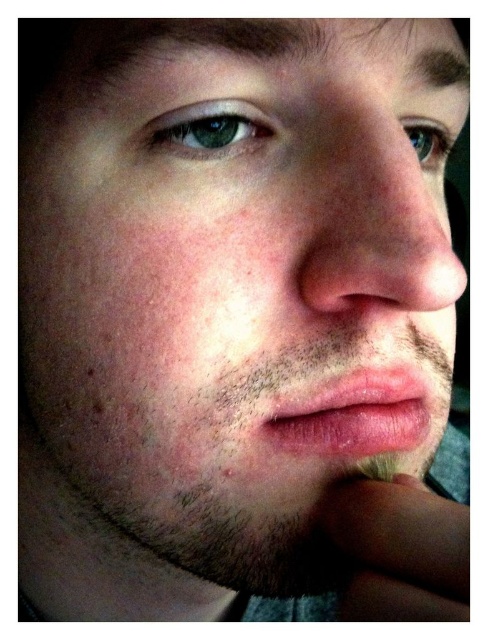
You are a makeup artist preparing to apply lipstick to a client. You notice the dry matte lips at center and the green matte eye at upper left. Which object is positioned lower in the face?

The dry matte lips at center is below the green matte eye at upper left, so the dry matte lips at center is positioned lower in the face.

Based on the scene description, which object is positioned higher on the face between the pink smooth nose at center and the green matte eye at upper left?

The green matte eye at upper left is positioned higher on the face than the pink smooth nose at center.